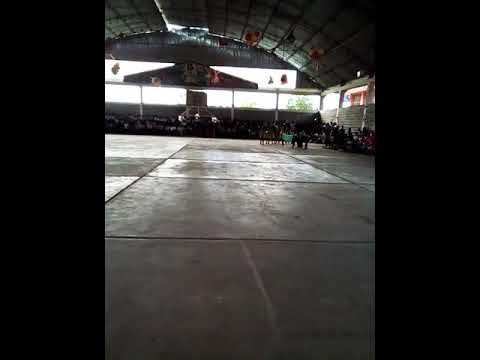
At what (x,y) coordinates should I click in order to perform the action: click on floor. Please return your answer as a coordinate pair (x, y). Image resolution: width=480 pixels, height=360 pixels. Looking at the image, I should click on (212, 217).